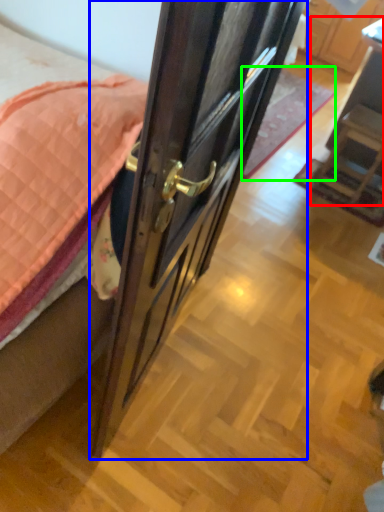
Question: Based on their relative distances, which object is farther from furniture (highlighted by a red box)? Choose from door (highlighted by a blue box) and plain (highlighted by a green box).

Choices:
 (A) door
 (B) plain

Answer: (A)